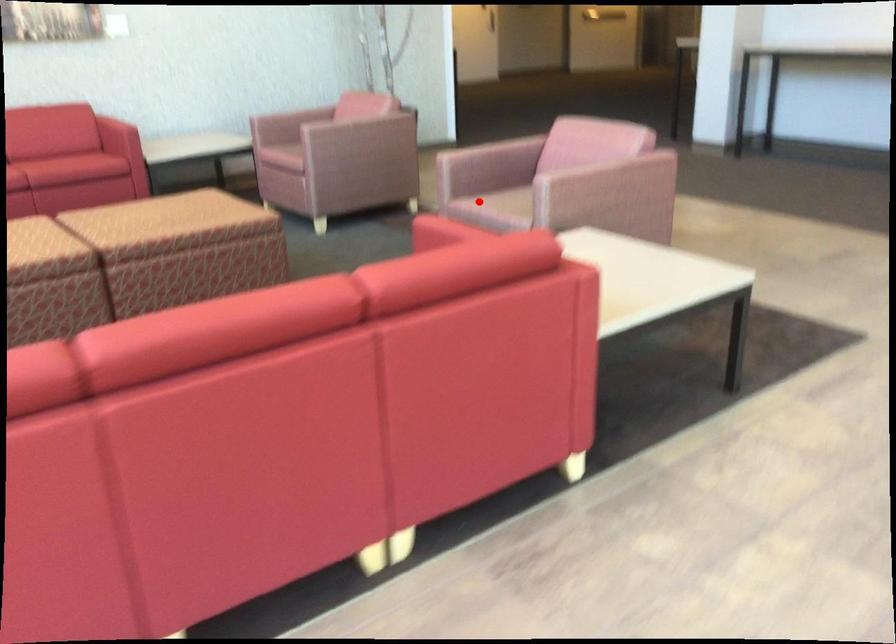
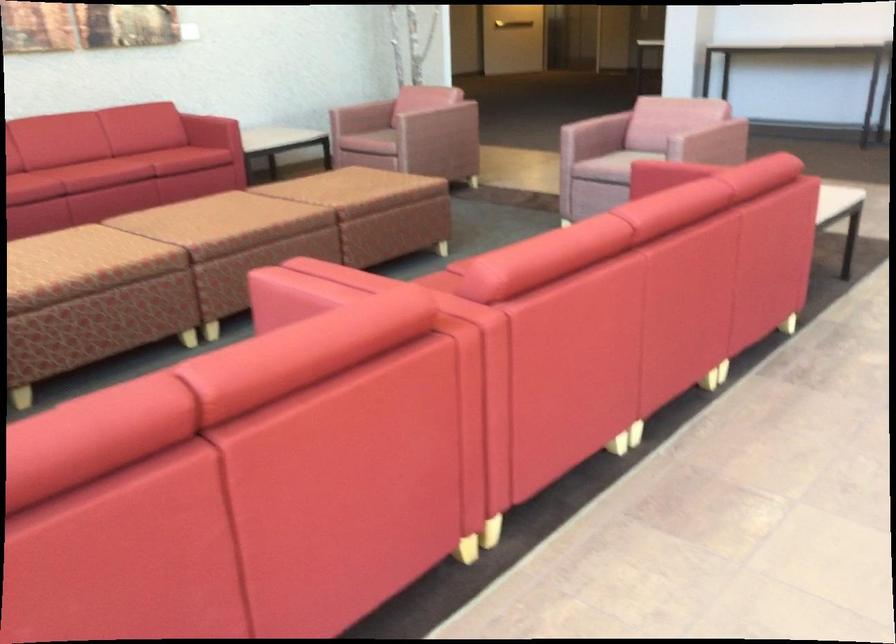
Question: I am providing you with two images of the same scene from different viewpoints. Image1 has a red point marked. In image2, the corresponding 3D location appears at what relative position? Reply with the corresponding letter.

Choices:
 (A) Closer
 (B) Farther

Answer: (B)